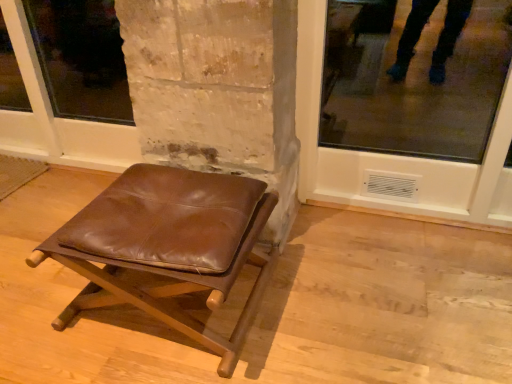
Where is `vacant space to the right of brown leather stool at center`? This screenshot has height=384, width=512. vacant space to the right of brown leather stool at center is located at coordinates (326, 291).